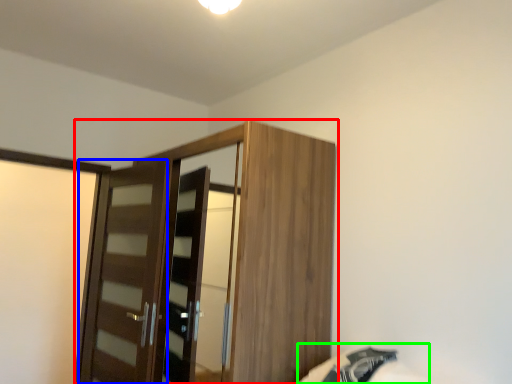
Question: Estimate the real-world distances between objects in this image. Which object is farther from cupboard (highlighted by a red box), door (highlighted by a blue box) or bed (highlighted by a green box)?

Choices:
 (A) door
 (B) bed

Answer: (B)